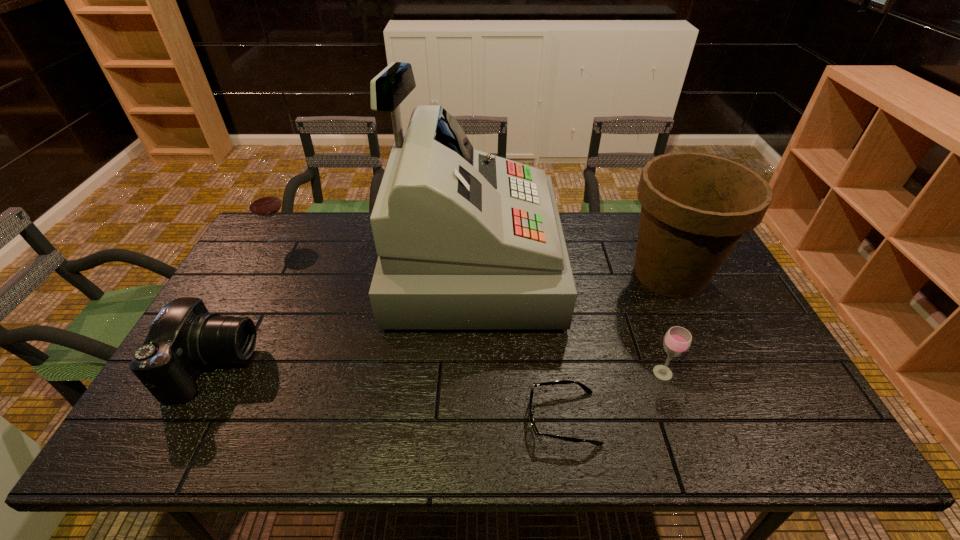
At what (x,y) coordinates should I click in order to perform the action: click on vacant space that satisfies the following two spatial constraints: 1. on the front side of the nearer wineglass; 2. on the front-facing side of the spectacles. Please return your answer as a coordinate pair (x, y). The width and height of the screenshot is (960, 540). Looking at the image, I should click on (679, 418).

Image resolution: width=960 pixels, height=540 pixels. I want to click on vacant position in the image that satisfies the following two spatial constraints: 1. on the keypad side of the cash register; 2. on the right side of the right wineglass, so click(x=468, y=373).